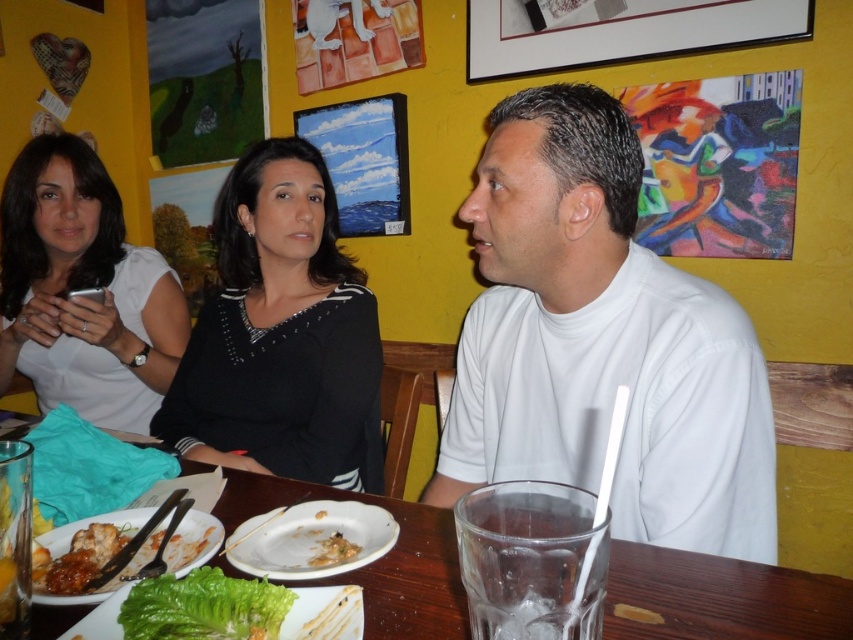
You are a waiter in a restaurant and need to place a new dish on the table. The table has two points marked for placing dishes. The points are point (381,636) and point (210,582). Which point should you choose to place the dish so that it is closer to the edge of the table?

Point (210,582) should be chosen because it is closer to the edge of the table compared to point (381,636).

In the scene shown: You are a waiter in a restaurant and need to place a new menu on the table. The menu is 10 cm tall. There is a black jersey at center and a green leafy lettuce at lower left on the table. Which object will the menu fit under if placed beneath it?

The menu will fit under the black jersey at center because it has a greater height compared to the green leafy lettuce at lower left, providing enough space for the menu to be placed underneath.